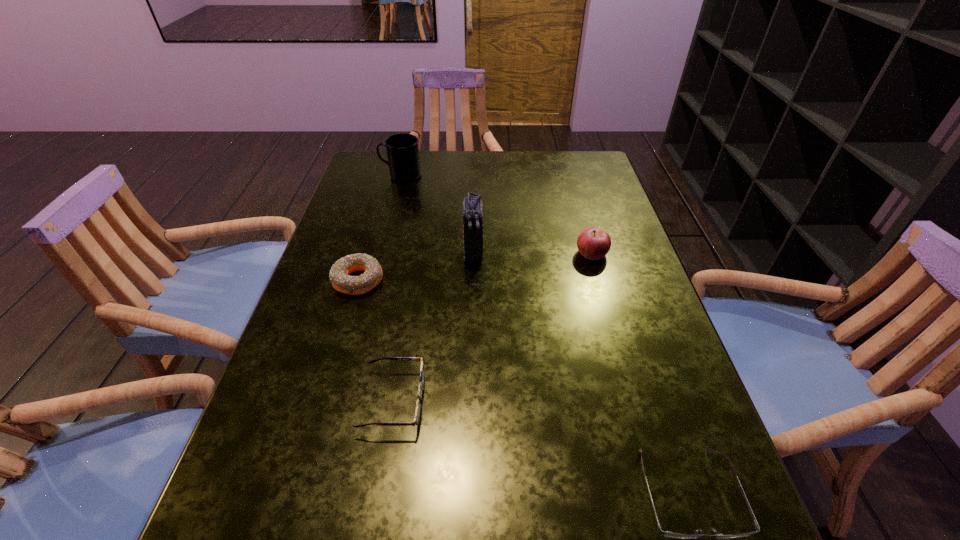
Identify the location of object identified as the third closest to the farther spectacles. (664, 533).

Locate an element on the screen. free space that satisfies the following two spatial constraints: 1. with the zip open on the clutch bag; 2. on the frame of the second nearest object is located at coordinates (471, 400).

Locate an element on the screen. Image resolution: width=960 pixels, height=540 pixels. free point that satisfies the following two spatial constraints: 1. with the zip open on the tallest object; 2. on the frame of the farther spectacles is located at coordinates point(471,400).